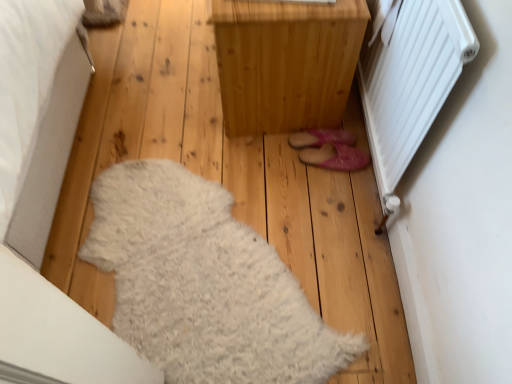
The height and width of the screenshot is (384, 512). Identify the location of blank space to the left of natural wood cabinet at center. (140, 75).